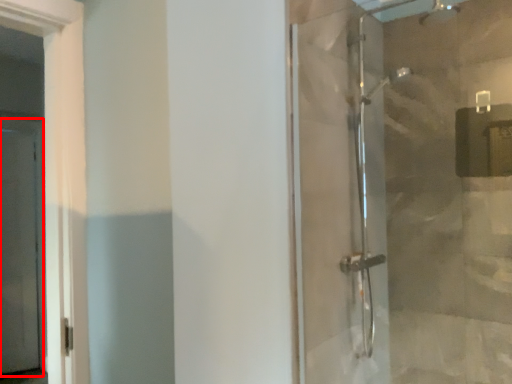
Question: From the image's perspective, what is the correct spatial relationship of screen door (annotated by the red box) in relation to shower door?

Choices:
 (A) below
 (B) above

Answer: (A)